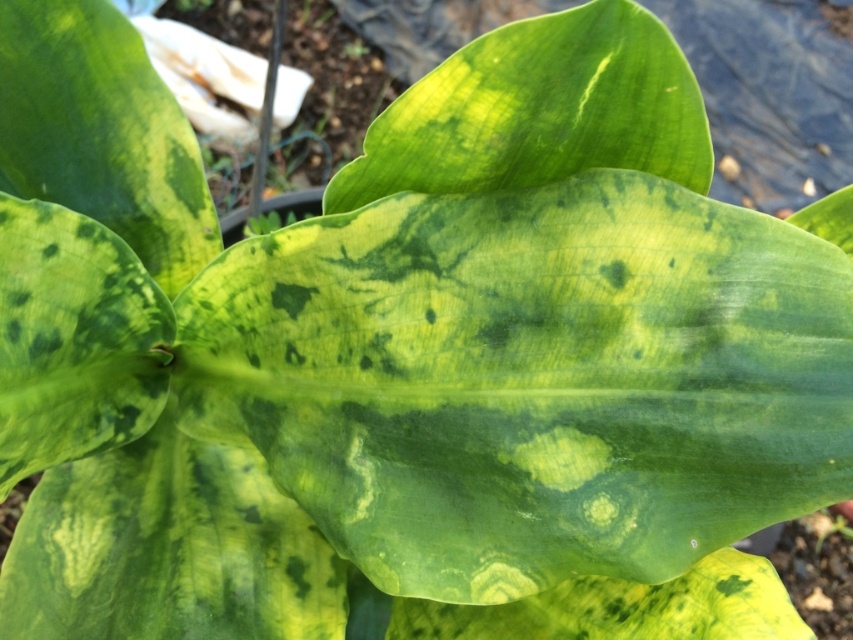
You are a botanist examining the plant in the image. You need to determine which leaf has a greater width between the green spotted leaf at center and the green textured leaf at center. Which one is wider?

The green spotted leaf at center is wider than the green textured leaf at center.

You are a botanist examining two leaves on the same plant. The green spotted leaf at center has dark spots, and the green textured leaf at center has a glossy surface. Which leaf is longer?

The green spotted leaf at center is taller than the green textured leaf at center, so it is longer.